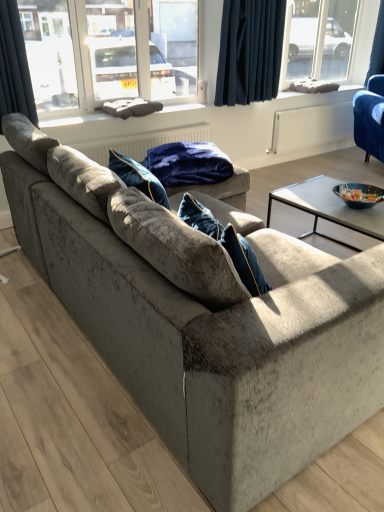
Question: From the image's perspective, is blue fabric cushion at upper center, the second window sill ordered from the bottom, positioned above or below velvet blue armchair at upper right?

Choices:
 (A) below
 (B) above

Answer: (B)

Question: In the image, is blue fabric cushion at upper center, the first window sill in the right-to-left sequence, positioned in front of or behind velvet blue armchair at upper right?

Choices:
 (A) behind
 (B) front

Answer: (A)

Question: Based on their relative distances, which object is farther from the clear glass window frame at upper center?

Choices:
 (A) velvet blue blanket at center
 (B) gray fabric cushion at center, positioned as the 2th window sill in right-to-left order
 (C) dark blue velvet curtain at upper left, the 1th curtain in the front-to-back sequence
 (D) velvet blue armchair at upper right
 (E) dark blue fabric at upper center, which is the 2th curtain in left-to-right order

Answer: (D)

Question: Which of these objects is positioned closest to the dark blue velvet curtain at upper right, acting as the 3th curtain starting from the front?

Choices:
 (A) blue fabric cushion at upper center, which is the first window sill from top to bottom
 (B) velvet blue armchair at upper right
 (C) clear glass window frame at upper center
 (D) velvet blue blanket at center
 (E) dark blue fabric at upper center, which is the 2th curtain in left-to-right order

Answer: (A)